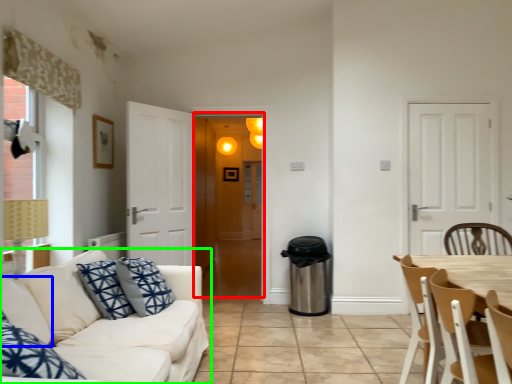
Question: Which is nearer to the screen door (highlighted by a red box)? pillow (highlighted by a blue box) or studio couch (highlighted by a green box).

Choices:
 (A) pillow
 (B) studio couch

Answer: (B)